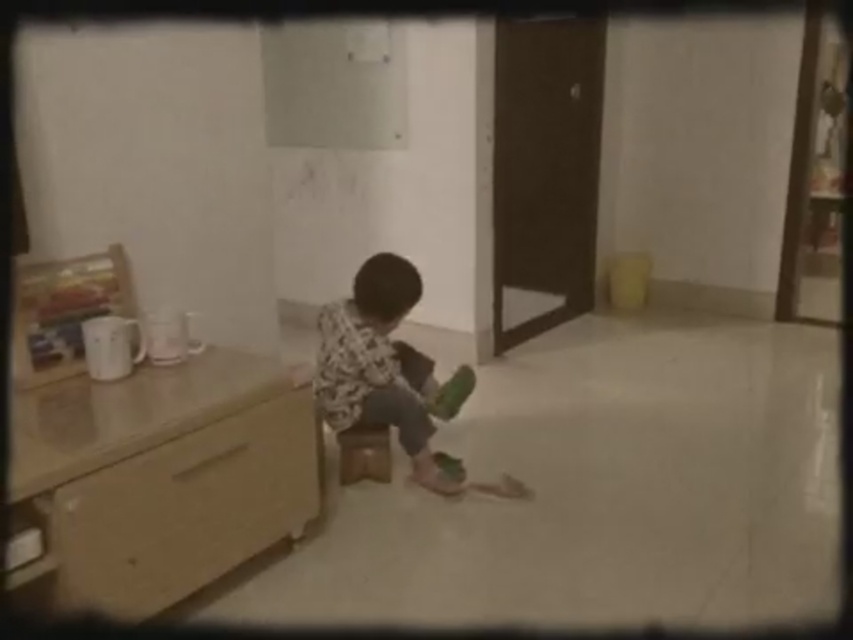
Question: Is wooden drawer at lower left smaller than brown wooden stool at center?

Choices:
 (A) no
 (B) yes

Answer: (A)

Question: Considering the real-world distances, which object is closest to the brown wooden stool at center?

Choices:
 (A) wooden drawer at lower left
 (B) printed cotton shirt at center

Answer: (B)

Question: Which point is farther to the camera?

Choices:
 (A) wooden drawer at lower left
 (B) brown wooden stool at center

Answer: (B)

Question: Which point is farther to the camera?

Choices:
 (A) (340, 451)
 (B) (306, 390)

Answer: (A)

Question: Is wooden drawer at lower left positioned in front of brown wooden stool at center?

Choices:
 (A) no
 (B) yes

Answer: (B)

Question: Does wooden drawer at lower left have a lesser width compared to printed cotton shirt at center?

Choices:
 (A) yes
 (B) no

Answer: (A)